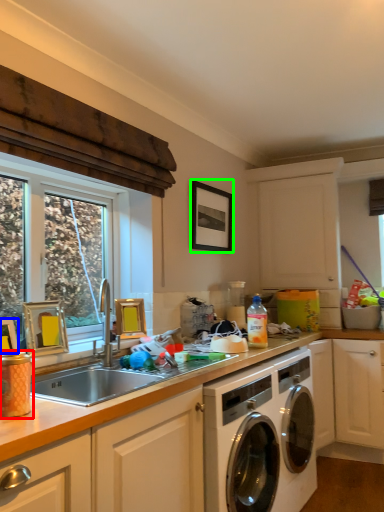
Question: Which is nearer to the appliance (highlighted by a red box)? picture frame (highlighted by a blue box) or picture frame (highlighted by a green box).

Choices:
 (A) picture frame
 (B) picture frame

Answer: (A)